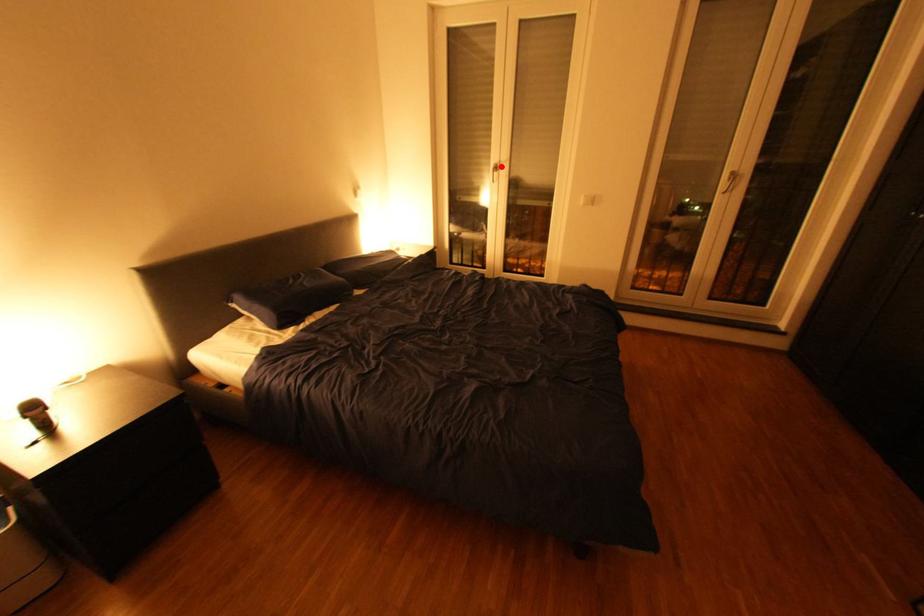
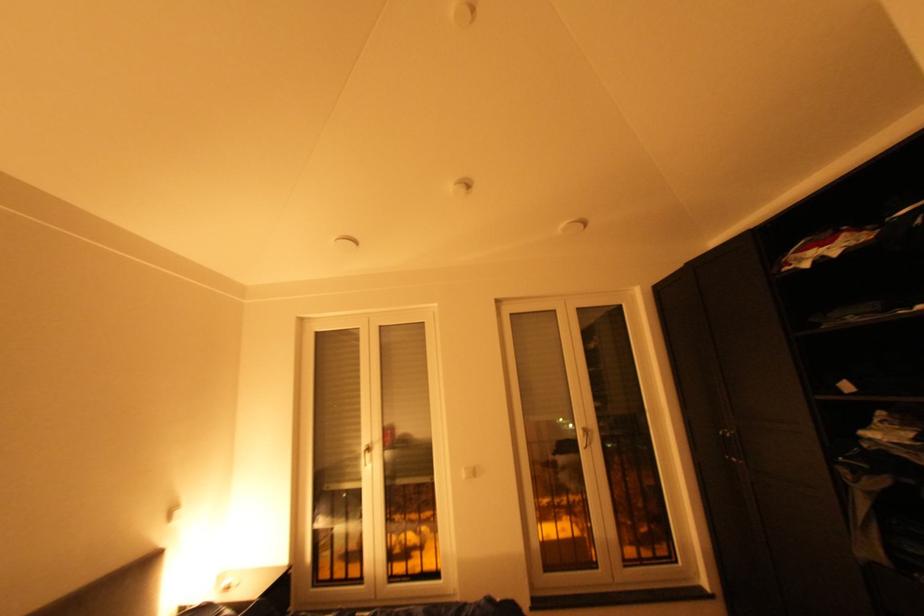
Question: I am providing you with two images of the same scene from different viewpoints. A red point is marked on the first image. At the location where the point appears in image 1, is it still visible in image 2?

Choices:
 (A) Yes
 (B) No

Answer: (A)